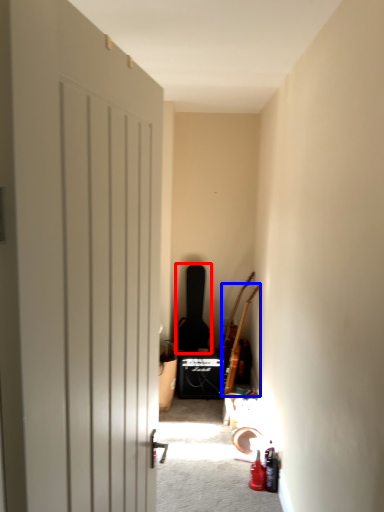
Question: Which object appears farthest to the camera in this image, guitar (highlighted by a red box) or guitar (highlighted by a blue box)?

Choices:
 (A) guitar
 (B) guitar

Answer: (A)